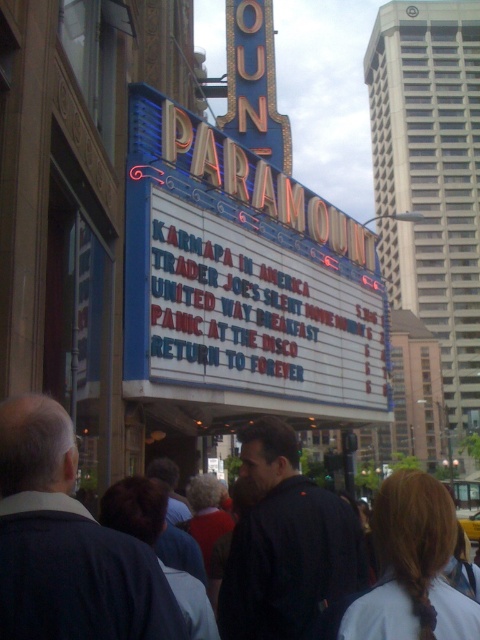
Can you confirm if dark blue clothing at center is positioned below yellow rubber taxi at center?

Incorrect, dark blue clothing at center is not positioned below yellow rubber taxi at center.

Is dark blue clothing at center positioned in front of yellow rubber taxi at center?

Yes, dark blue clothing at center is in front of yellow rubber taxi at center.

Looking at this image, who is more forward, (x=98, y=534) or (x=478, y=515)?

Point (x=98, y=534)

Identify the location of dark blue clothing at center. The image size is (480, 640). point(68,545).